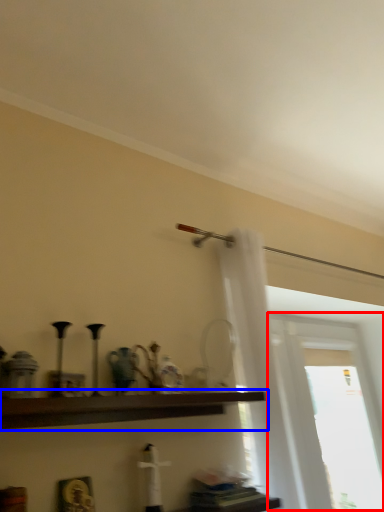
Question: Among these objects, which one is farthest to the camera, window (highlighted by a red box) or shelf (highlighted by a blue box)?

Choices:
 (A) window
 (B) shelf

Answer: (A)